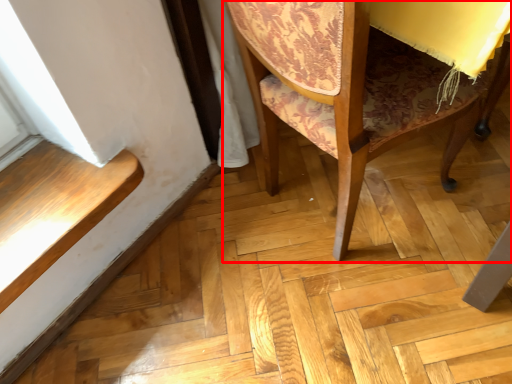
Question: From the image's perspective, what is the correct spatial positioning of chair (annotated by the red box) in reference to stairwell?

Choices:
 (A) below
 (B) above

Answer: (B)